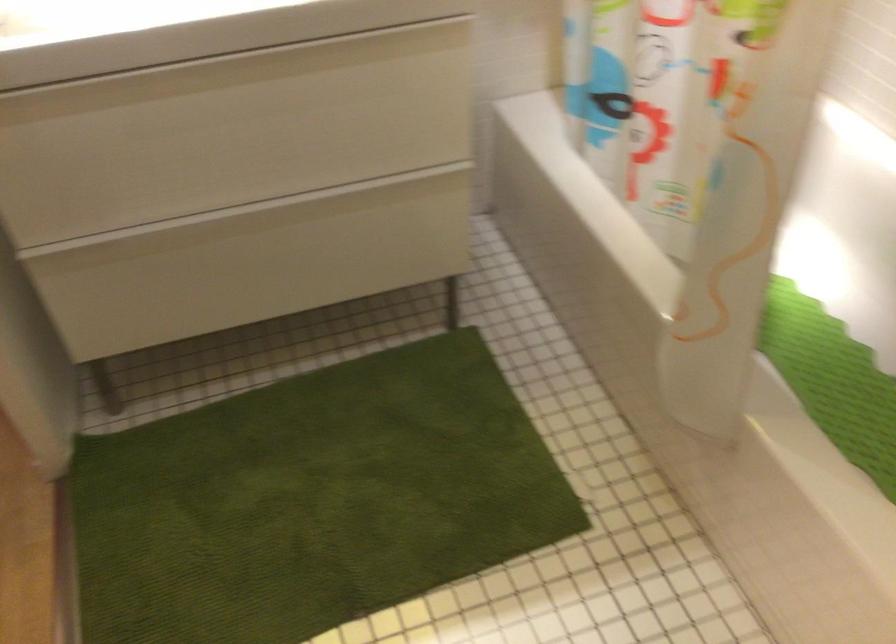
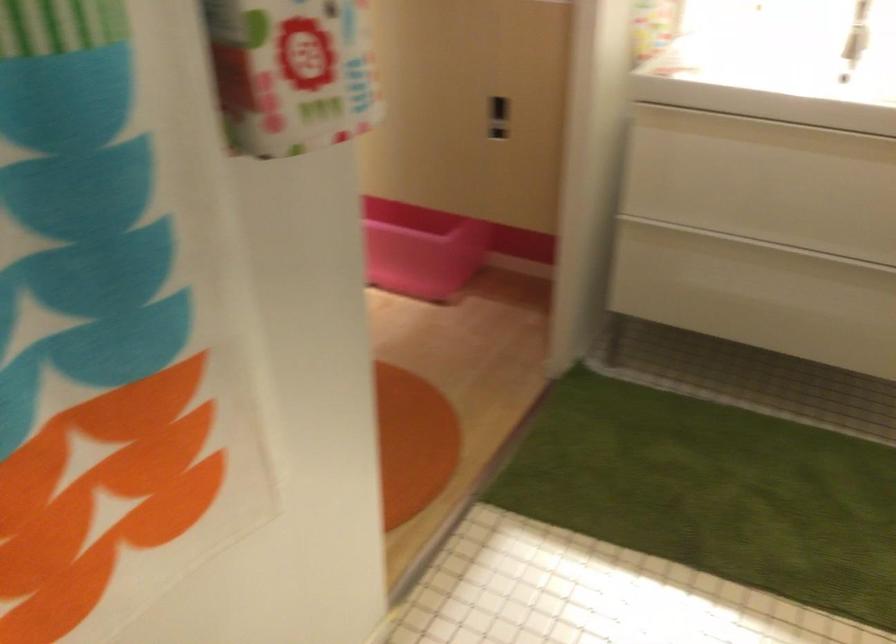
Question: How did the camera likely rotate?

Choices:
 (A) Left
 (B) Right
 (C) Up
 (D) Down

Answer: (A)